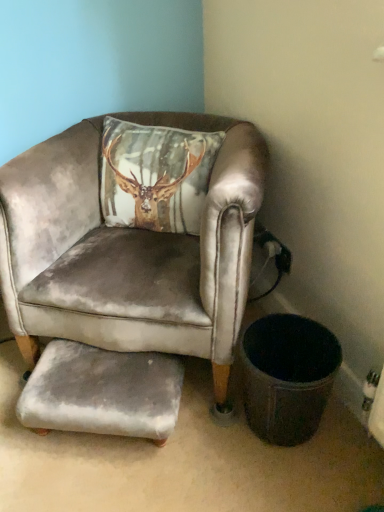
Question: Relative to velvet gray armchair at center, is gray velvety footrest at lower center in front or behind?

Choices:
 (A) front
 (B) behind

Answer: (B)

Question: In the image, is gray velvety footrest at lower center on the left side or the right side of velvet gray armchair at center?

Choices:
 (A) left
 (B) right

Answer: (A)

Question: Does point (170, 376) appear closer or farther from the camera than point (210, 218)?

Choices:
 (A) closer
 (B) farther

Answer: (B)

Question: Is velvet gray armchair at center wider or thinner than gray velvety footrest at lower center?

Choices:
 (A) wide
 (B) thin

Answer: (A)

Question: Does point (4, 253) appear closer or farther from the camera than point (59, 364)?

Choices:
 (A) farther
 (B) closer

Answer: (A)

Question: Is velvet gray armchair at center in front of or behind gray velvety footrest at lower center in the image?

Choices:
 (A) front
 (B) behind

Answer: (A)

Question: Considering the relative positions of velvet gray armchair at center and gray velvety footrest at lower center in the image provided, is velvet gray armchair at center to the left or to the right of gray velvety footrest at lower center?

Choices:
 (A) left
 (B) right

Answer: (B)